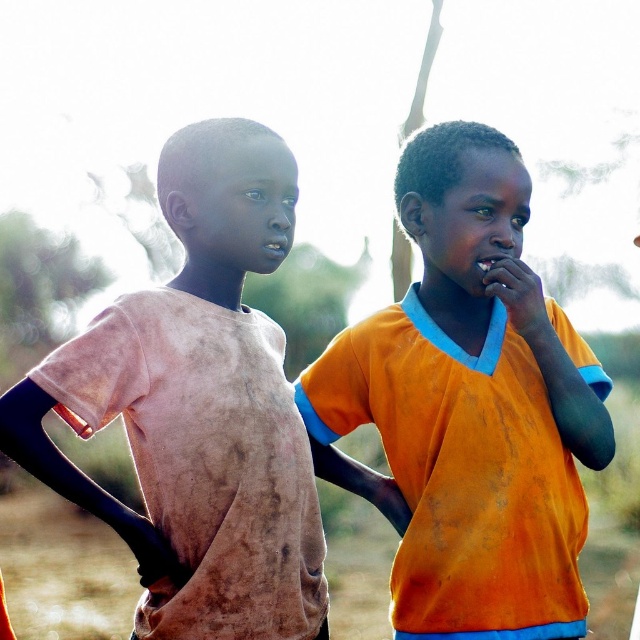
Question: Does orange fabric shirt at center lie behind dirty pink shirt at left?

Choices:
 (A) yes
 (B) no

Answer: (A)

Question: Among these objects, which one is nearest to the camera?

Choices:
 (A) orange fabric shirt at center
 (B) dirty pink shirt at left

Answer: (B)

Question: Is orange fabric shirt at center above dirty pink shirt at left?

Choices:
 (A) no
 (B) yes

Answer: (B)

Question: In this image, where is orange fabric shirt at center located relative to dirty pink shirt at left?

Choices:
 (A) left
 (B) right

Answer: (B)

Question: Which of the following is the closest to the observer?

Choices:
 (A) (275, 170)
 (B) (541, 371)

Answer: (A)